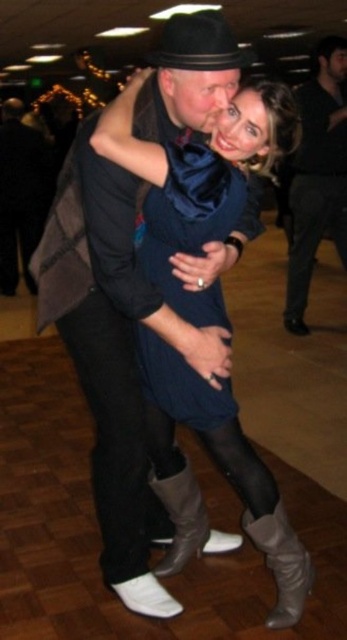
Looking at this image, you are a photographer at the dance event and want to capture a closeup of the two dancers. Given that the velvet blue dress at center and dark gray textured pants at center are in the same focal area, which one would appear smaller in the photo?

The velvet blue dress at center appears smaller in the photo because it has a lesser width compared to the dark gray textured pants at center.

You are a photographer at the dance event and want to capture a photo of the velvet blue dress at center and dark gray textured pants at center in the same frame. Your camera has a maximum focus range of 2 meters. Will you be able to capture both subjects clearly in the photo?

The velvet blue dress at center is 2.55 meters away from dark gray textured pants at center. Since the distance between them exceeds the camera maximum focus range of 2 meters, the photographer will not be able to capture both subjects clearly in the same frame.